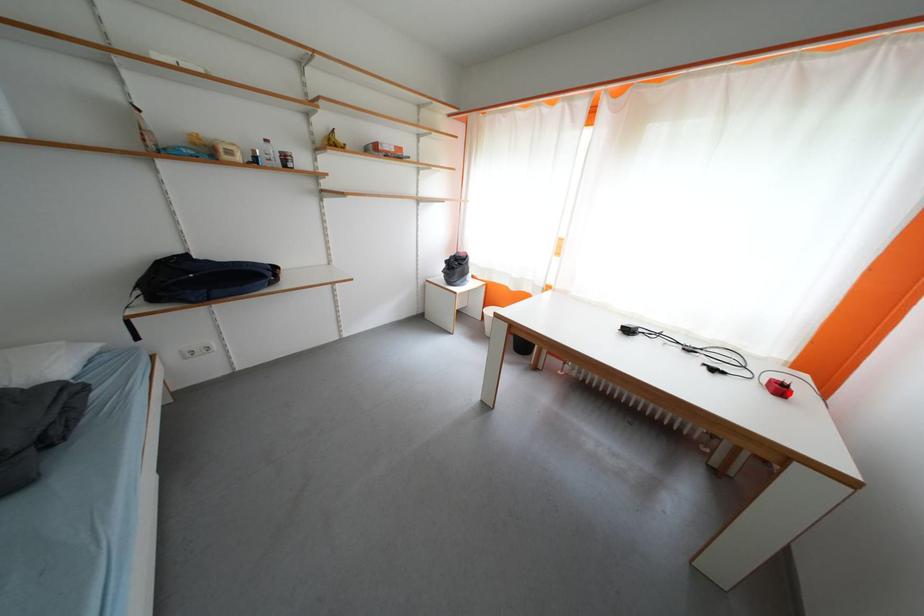
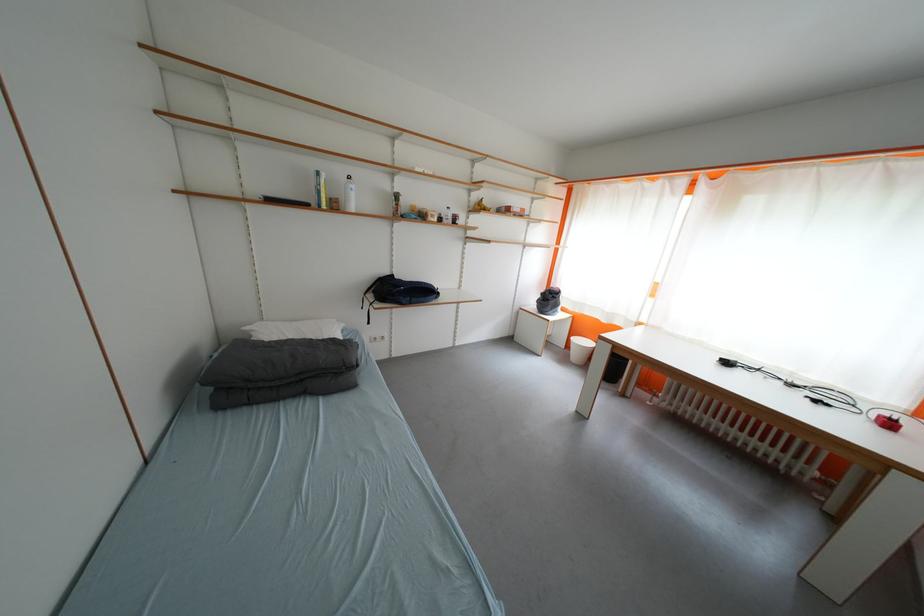
Question: I am providing you with two images of the same scene from different viewpoints. A red point is shown in image1. For the corresponding object point in image2, is it positioned nearer or farther from the camera?

Choices:
 (A) Nearer
 (B) Farther

Answer: (A)